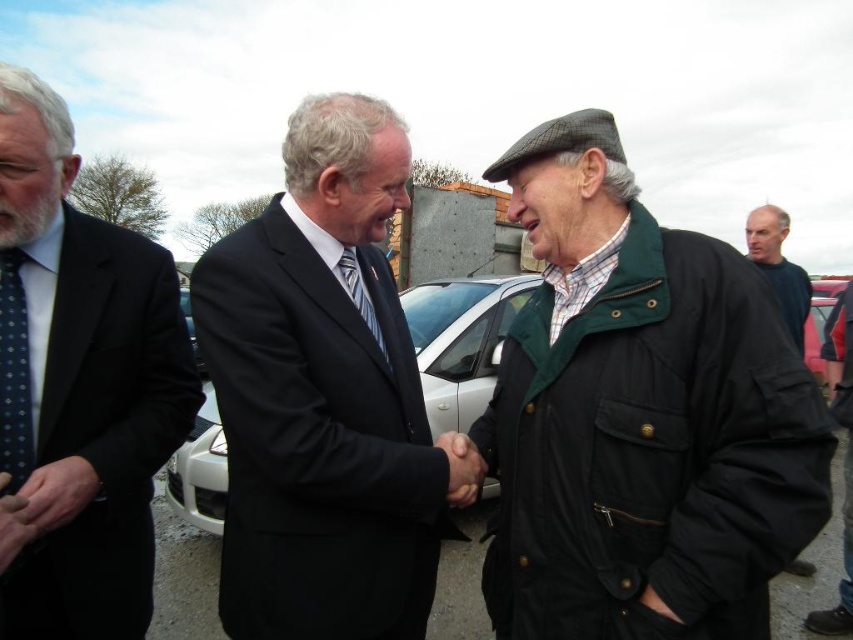
Question: Does matte black suit at center lie in front of polished dark suit at left?

Choices:
 (A) yes
 (B) no

Answer: (B)

Question: Can you confirm if dark blue fabric at right is bigger than polka dot silk tie at center?

Choices:
 (A) yes
 (B) no

Answer: (A)

Question: Estimate the real-world distances between objects in this image. Which object is closer to the dark blue dotted tie at left?

Choices:
 (A) polka dot silk tie at center
 (B) matte black suit at center

Answer: (B)

Question: Can you confirm if dark blue dotted tie at left is positioned below dark blue fabric at right?

Choices:
 (A) yes
 (B) no

Answer: (A)

Question: Estimate the real-world distances between objects in this image. Which object is farther from the matte black suit at center?

Choices:
 (A) polka dot silk tie at center
 (B) dark blue fabric at right
 (C) dark blue dotted tie at left

Answer: (B)

Question: Which of the following is the farthest from the observer?

Choices:
 (A) (386, 186)
 (B) (77, 522)

Answer: (A)